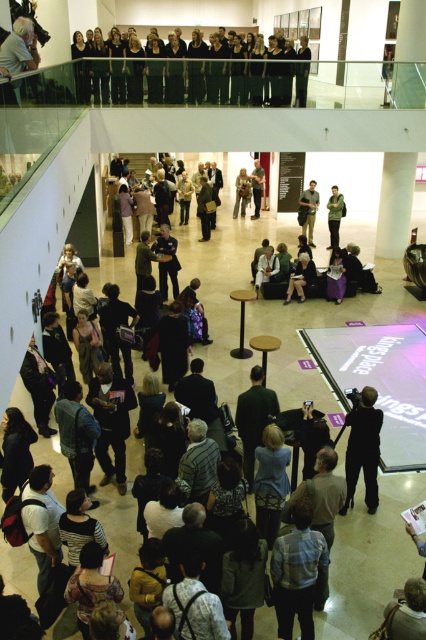
You are standing in the event space and want to move from point A to point B. Point A is at coordinate point (241, 180) and point B is at coordinate point (258, 157). Which point is closer to you when you first arrive?

Point A at coordinate point (241, 180) is closer to you than point B at coordinate point (258, 157) because it is nearer in the scene.

You are a photographer at the event and want to capture both the dark gray fabric jacket at center and the light brown fabric jacket at center in the same frame. Which jacket should you focus on first to ensure both are in the shot?

The dark gray fabric jacket at center is positioned on the right side of light brown fabric jacket at center, so focusing on the light brown fabric jacket at center first will allow the dark gray one to naturally fall into the frame to its right.